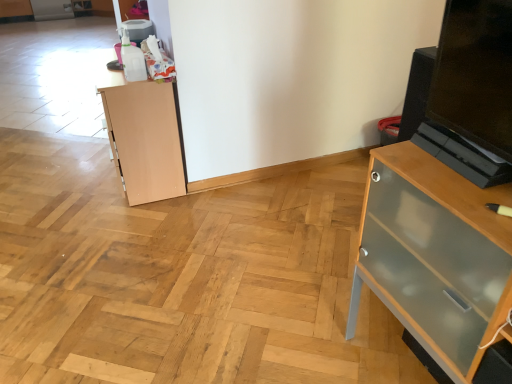
Question: Considering the relative sizes of light brown wood cupboard at left and clear glass cabinet at right in the image provided, is light brown wood cupboard at left taller than clear glass cabinet at right?

Choices:
 (A) yes
 (B) no

Answer: (B)

Question: From the image's perspective, is light brown wood cupboard at left beneath clear glass cabinet at right?

Choices:
 (A) yes
 (B) no

Answer: (B)

Question: Can you confirm if light brown wood cupboard at left is shorter than clear glass cabinet at right?

Choices:
 (A) yes
 (B) no

Answer: (A)

Question: Is there a large distance between light brown wood cupboard at left and clear glass cabinet at right?

Choices:
 (A) yes
 (B) no

Answer: (A)

Question: Can you confirm if light brown wood cupboard at left is smaller than clear glass cabinet at right?

Choices:
 (A) no
 (B) yes

Answer: (B)

Question: Is light brown wood cupboard at left at the left side of clear glass cabinet at right?

Choices:
 (A) yes
 (B) no

Answer: (A)

Question: Is clear glass cabinet at right positioned beyond the bounds of light brown wood cupboard at left?

Choices:
 (A) yes
 (B) no

Answer: (A)

Question: Can you confirm if clear glass cabinet at right is taller than light brown wood cupboard at left?

Choices:
 (A) yes
 (B) no

Answer: (A)

Question: Considering the relative sizes of clear glass cabinet at right and light brown wood cupboard at left in the image provided, is clear glass cabinet at right thinner than light brown wood cupboard at left?

Choices:
 (A) no
 (B) yes

Answer: (A)

Question: Are clear glass cabinet at right and light brown wood cupboard at left located far from each other?

Choices:
 (A) no
 (B) yes

Answer: (B)

Question: Is clear glass cabinet at right oriented away from light brown wood cupboard at left?

Choices:
 (A) no
 (B) yes

Answer: (A)

Question: Could you tell me if clear glass cabinet at right is turned towards light brown wood cupboard at left?

Choices:
 (A) no
 (B) yes

Answer: (A)

Question: Is light brown wood cupboard at left in front of or behind clear glass cabinet at right in the image?

Choices:
 (A) behind
 (B) front

Answer: (A)